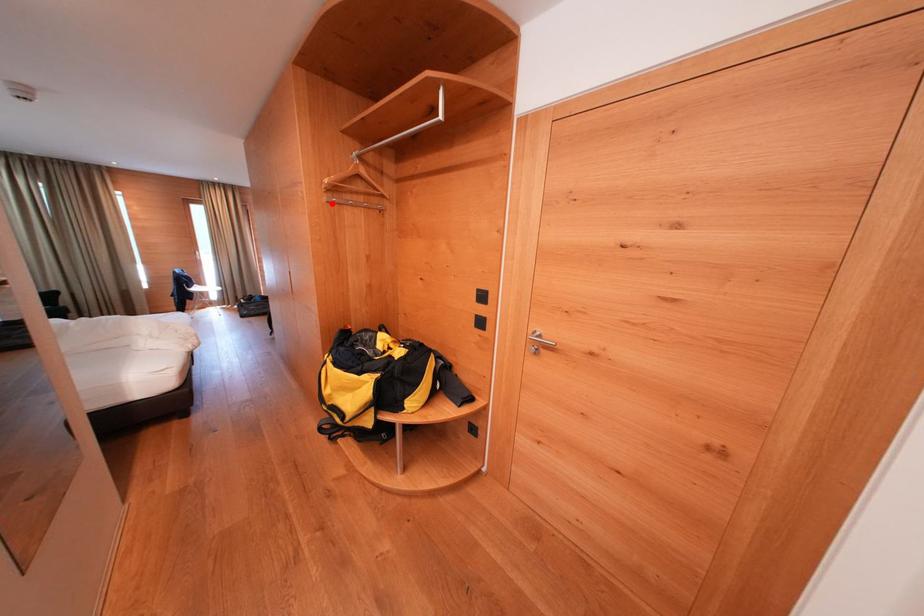
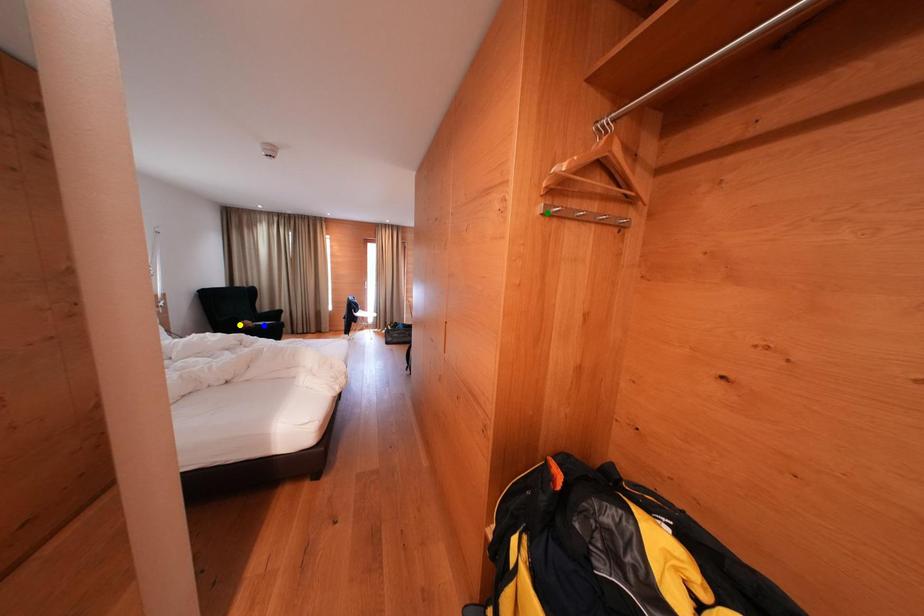
Question: I am providing you with two images of the same scene from different viewpoints. A red point is marked on the first image. You are given multiple points on the second image. Which point in image 2 represents the same 3d spot as the red point in image 1?

Choices:
 (A) green point
 (B) yellow point
 (C) blue point

Answer: (A)